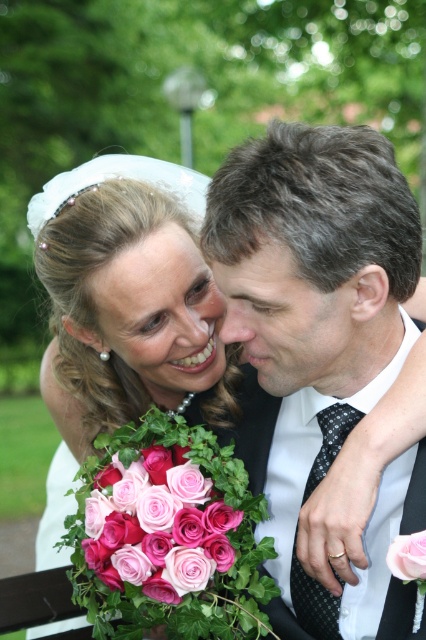
Question: Is polished black suit at center below smooth skin at center?

Choices:
 (A) no
 (B) yes

Answer: (B)

Question: Considering the real-world distances, which object is closest to the polished black suit at center?

Choices:
 (A) smooth skin at center
 (B) pink matte rose at center

Answer: (B)

Question: Observing the image, what is the correct spatial positioning of pink matte roses at center in reference to smooth skin at center?

Choices:
 (A) right
 (B) left

Answer: (A)

Question: Among these points, which one is nearest to the camera?

Choices:
 (A) (293, 321)
 (B) (129, 298)

Answer: (A)

Question: Does smooth skin at center appear over pink matte rose at center?

Choices:
 (A) yes
 (B) no

Answer: (A)

Question: Which point is closer to the camera taking this photo?

Choices:
 (A) (255, 323)
 (B) (419, 577)

Answer: (B)